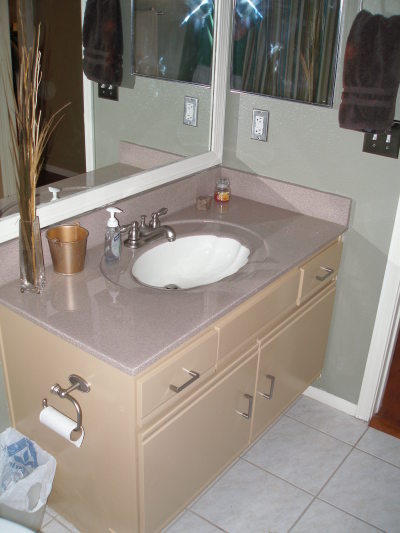
The height and width of the screenshot is (533, 400). I want to click on bathroom, so click(314, 153), click(279, 270), click(302, 475), click(72, 515).